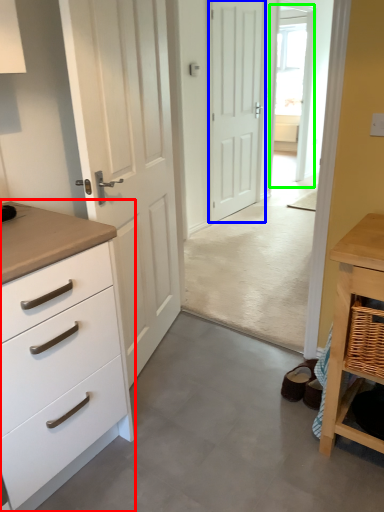
Question: Considering the real-world distances, which object is closest to chest of drawers (highlighted by a red box)? door (highlighted by a blue box) or glass door (highlighted by a green box).

Choices:
 (A) door
 (B) glass door

Answer: (A)